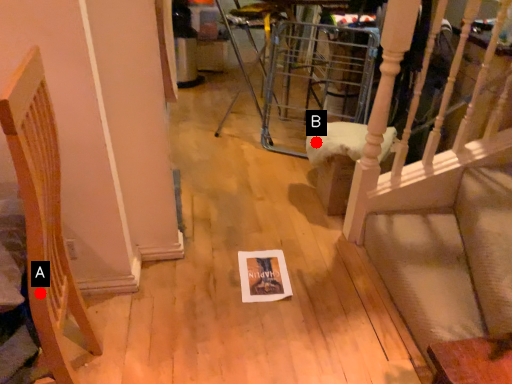
Question: Two points are circled on the image, labeled by A and B beside each circle. Which point appears closest to the camera in this image?

Choices:
 (A) A is closer
 (B) B is closer

Answer: (A)